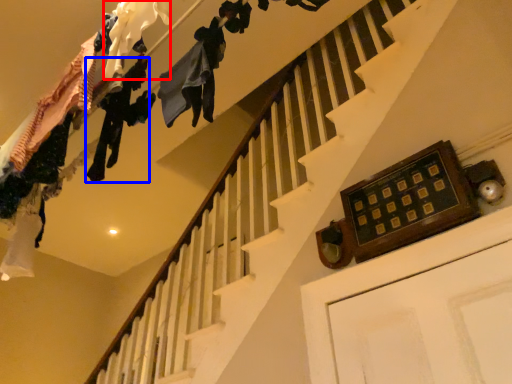
Question: Which point is further to the camera, clothing (highlighted by a red box) or clothing (highlighted by a blue box)?

Choices:
 (A) clothing
 (B) clothing

Answer: (B)